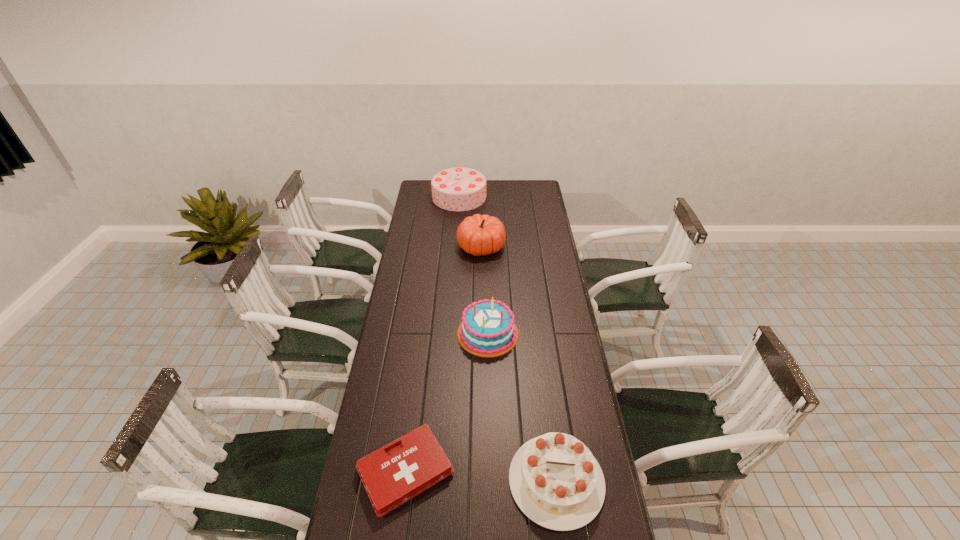
In the image, there is a desktop. Identify the location of vacant region at the right edge. (549, 272).

Image resolution: width=960 pixels, height=540 pixels. In order to click on free spot between the second shortest object and the shortest object in this screenshot , I will do `click(481, 476)`.

Locate an element on the screen. This screenshot has width=960, height=540. blank region between the third farthest object and the pumpkin is located at coordinates (485, 290).

Where is `vacant area that lies between the farthest birthday cake and the third farthest object`? Image resolution: width=960 pixels, height=540 pixels. vacant area that lies between the farthest birthday cake and the third farthest object is located at coordinates (473, 265).

You are a GUI agent. You are given a task and a screenshot of the screen. Output one action in this format:
    pyautogui.click(x=<x>, y=<y>)
    Task: Click on the free space between the first-aid kit and the farthest birthday cake
    Image resolution: width=960 pixels, height=540 pixels.
    Given the screenshot: What is the action you would take?
    pyautogui.click(x=432, y=334)

You are a GUI agent. You are given a task and a screenshot of the screen. Output one action in this format:
    pyautogui.click(x=<x>, y=<y>)
    Task: Click on the empty location between the shortest birthday cake and the shortest object
    This screenshot has height=540, width=960.
    Given the screenshot: What is the action you would take?
    pyautogui.click(x=481, y=476)

Find the location of `free spot between the shortest object and the second farthest birthday cake`. free spot between the shortest object and the second farthest birthday cake is located at coordinates (446, 402).

The image size is (960, 540). What are the coordinates of `vacant space in between the first-aid kit and the nearest birthday cake` in the screenshot? It's located at (481, 476).

This screenshot has width=960, height=540. I want to click on vacant area that lies between the pumpkin and the second shortest object, so click(x=518, y=363).

What are the coordinates of `vacant region between the third nearest object and the second shortest object` in the screenshot? It's located at (522, 407).